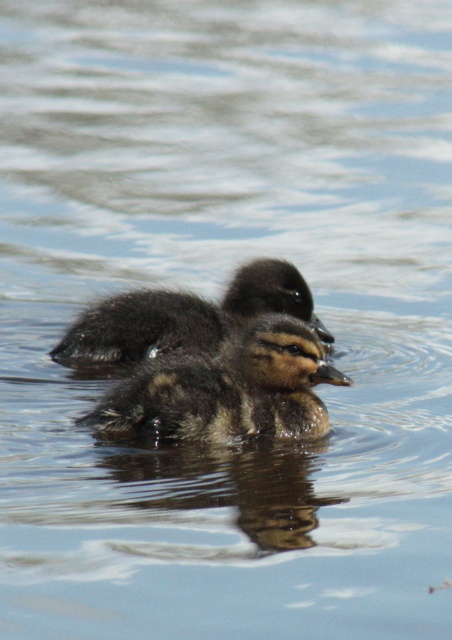
You are a photographer trying to capture both ducklings in a single shot. Since the brown fuzzy duckling at center and the dark brown fluffy duckling at center are both at the center, which duckling would appear closer to the camera?

The brown fuzzy duckling at center appears closer to the camera because it is shorter than the dark brown fluffy duckling at center, so it would be positioned in front.

You are a photographer trying to capture both ducklings in a single shot. Given that your camera has a 100mm lens with a depth of field that can focus on objects within a 15 inch range, will both the brown fuzzy duckling at center and the dark brown fluffy duckling at center be in focus?

The brown fuzzy duckling at center is 21.67 inches away from the dark brown fluffy duckling at center. Since the depth of field can only focus within a 15 inch range, the distance between them exceeds this limit. Therefore, both ducklings cannot be in focus simultaneously with the current lens setting.

You are a photographer trying to capture a clear shot of both the brown fuzzy duckling at center and the dark brown fluffy duckling at center. Which duckling is positioned lower in the water?

The brown fuzzy duckling at center is positioned lower in the water than the dark brown fluffy duckling at center.